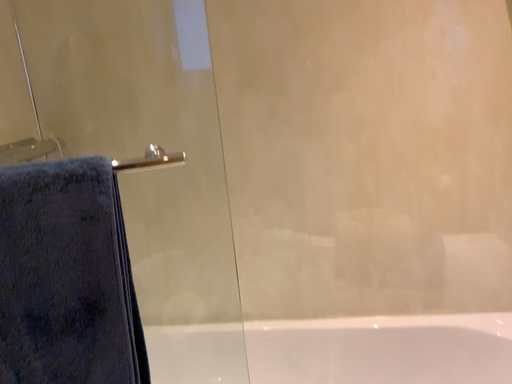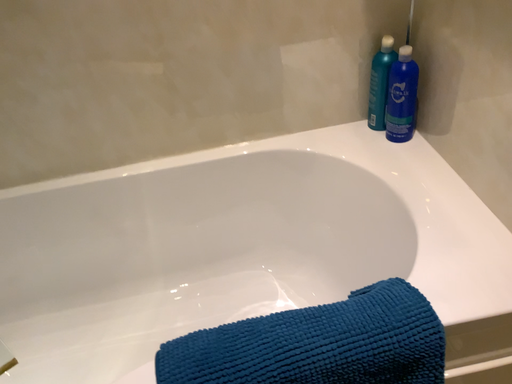
Question: How did the camera likely rotate when shooting the video?

Choices:
 (A) rotated upward
 (B) rotated downward

Answer: (B)